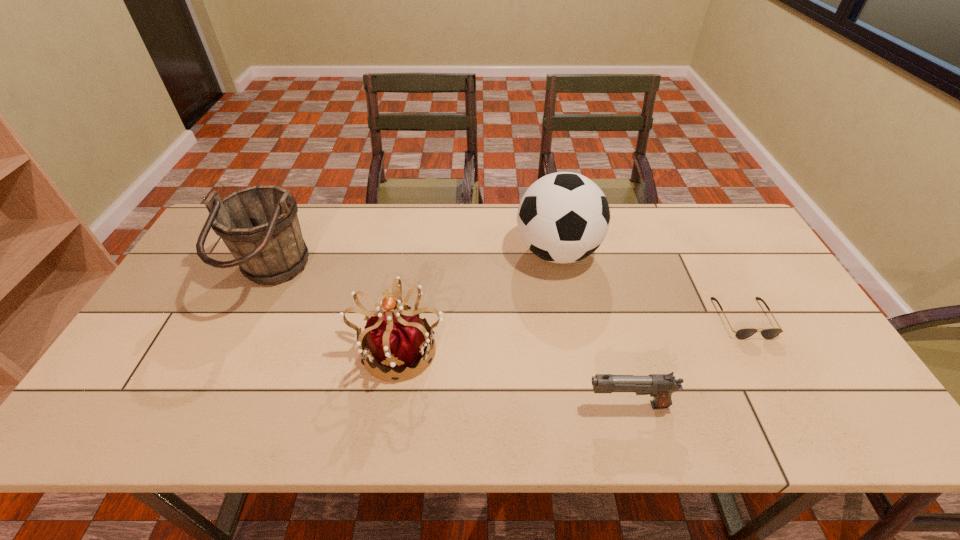
This screenshot has height=540, width=960. Find the location of `soccer ball`. soccer ball is located at coordinates (563, 217).

This screenshot has height=540, width=960. Identify the location of bucket. (259, 225).

Where is `tiara`? Image resolution: width=960 pixels, height=540 pixels. tiara is located at coordinates coord(398,340).

The image size is (960, 540). In order to click on the nearest object in this screenshot , I will do `click(660, 386)`.

This screenshot has width=960, height=540. Find the location of `gun`. gun is located at coordinates (660, 386).

Where is `sunglasses`? The height and width of the screenshot is (540, 960). sunglasses is located at coordinates (771, 333).

Locate an element on the screen. The width and height of the screenshot is (960, 540). the rightmost object is located at coordinates (771, 333).

Locate an element on the screen. The image size is (960, 540). free location located on the right of the soccer ball is located at coordinates tap(722, 252).

Image resolution: width=960 pixels, height=540 pixels. Identify the location of blank space located 0.390m on the handle side of the bucket. (443, 278).

Identify the location of blank area located on the front-facing side of the fourth object from right to left. This screenshot has width=960, height=540. (390, 409).